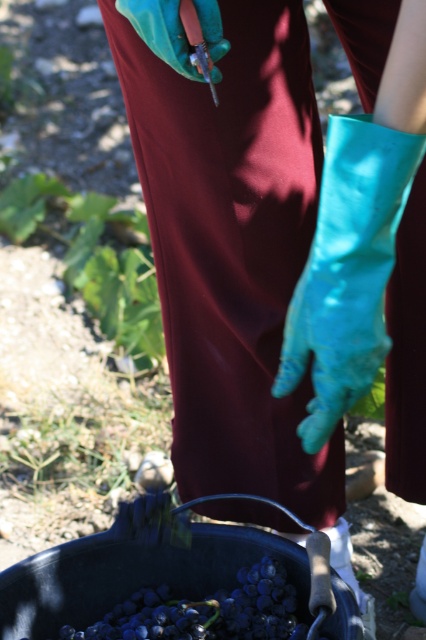
You are a farmer trying to reach the shiny purple grapes at lower center with a 1 meter long tool. Can you reach them?

The shiny purple grapes at lower center are 1.17 meters away, so the 1 meter long tool is not long enough to reach them.

From the picture: You are a farmer checking the grape harvest. You notice the shiny purple grapes at lower center and the teal rubber glove at upper center. Which object is closer to you?

The shiny purple grapes at lower center are closer to you because the teal rubber glove at upper center is behind them.